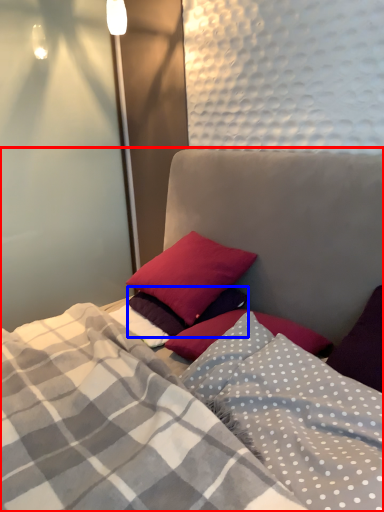
Question: Which of the following is the farthest to the observer, bed (highlighted by a red box) or pillow (highlighted by a blue box)?

Choices:
 (A) bed
 (B) pillow

Answer: (B)